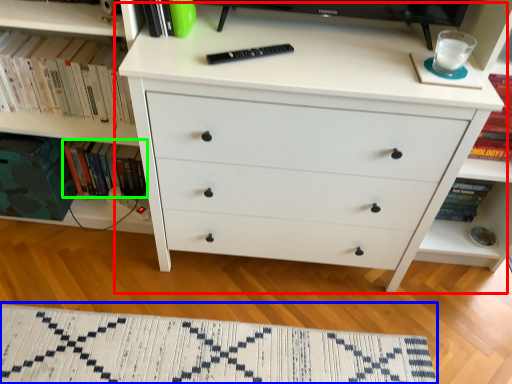
Question: Which is farther away from chest of drawers (highlighted by a red box)? mat (highlighted by a blue box) or book (highlighted by a green box)?

Choices:
 (A) mat
 (B) book

Answer: (B)